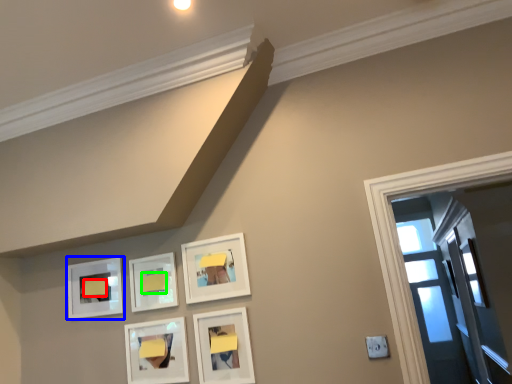
Question: Estimate the real-world distances between objects in this image. Which object is farther from furniture (highlighted by a red box), picture frame (highlighted by a blue box) or furniture (highlighted by a green box)?

Choices:
 (A) picture frame
 (B) furniture

Answer: (B)